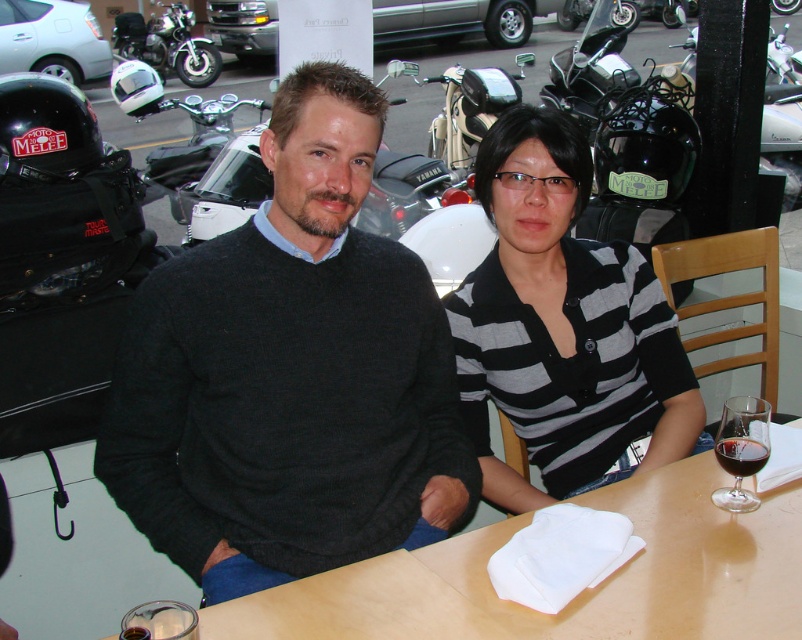
You are a photographer planning to take a portrait of the two people at the table. You want to ensure that both the shiny black motorcycle at upper right and the red glass at table right are visible in the frame. Given their heights, which object might require you to adjust your camera angle to include it in the photo?

The shiny black motorcycle at upper right has a greater height compared to the red glass at table right, so you might need to adjust your camera angle to include the shiny black motorcycle at upper right in the frame since it is taller.

You are a photographer trying to capture a clear shot of both the transparent glass at table right and the shiny black motorcycle at upper right. Since you can only focus on one object at a time, which one should you choose to ensure it appears sharp in the photo?

You should focus on the transparent glass at table right because it is closer to the viewer than the shiny black motorcycle at upper right, making it easier to capture in focus.